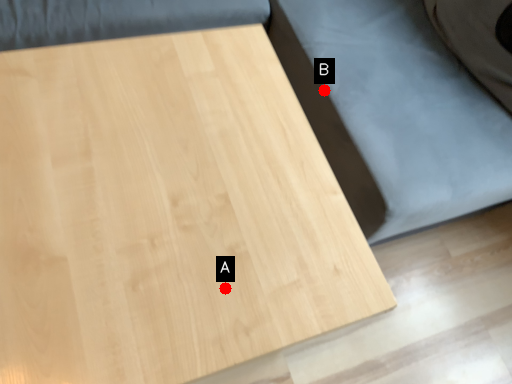
Question: Two points are circled on the image, labeled by A and B beside each circle. Which point is farther to the camera?

Choices:
 (A) A is further
 (B) B is further

Answer: (B)